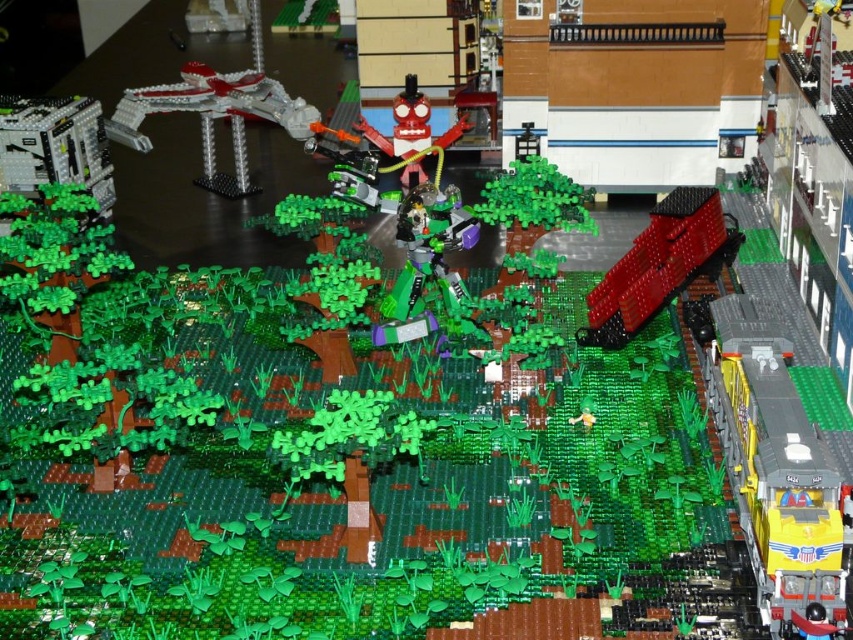
Can you confirm if green matte tree at center is positioned below matte red robot at center?

Correct, green matte tree at center is located below matte red robot at center.

Find the location of a particular element. The image size is (853, 640). green matte tree at center is located at coordinates (532, 196).

Is point (511, 170) closer to viewer compared to point (387, 164)?

Yes, it is in front of point (387, 164).

Where is `green matte tree at center`? This screenshot has width=853, height=640. green matte tree at center is located at coordinates (532, 196).

In the scene shown: Which of these two, black plastic clock at left or matte red robot at center, stands shorter?

black plastic clock at left

Which is above, black plastic clock at left or matte red robot at center?

matte red robot at center is higher up.

Where is `black plastic clock at left`? This screenshot has width=853, height=640. black plastic clock at left is located at coordinates (54, 147).

Is shiny red train at center-right positioned before shiny metallic spaceship at upper left?

Yes, shiny red train at center-right is in front of shiny metallic spaceship at upper left.

Based on the photo, which is more to the right, shiny red train at center-right or shiny metallic spaceship at upper left?

shiny red train at center-right

Who is more forward, (735,246) or (254,81)?

Point (735,246)

You are a GUI agent. You are given a task and a screenshot of the screen. Output one action in this format:
    pyautogui.click(x=<x>, y=<y>)
    Task: Click on the shiny red train at center-right
    
    Given the screenshot: What is the action you would take?
    pyautogui.click(x=659, y=262)